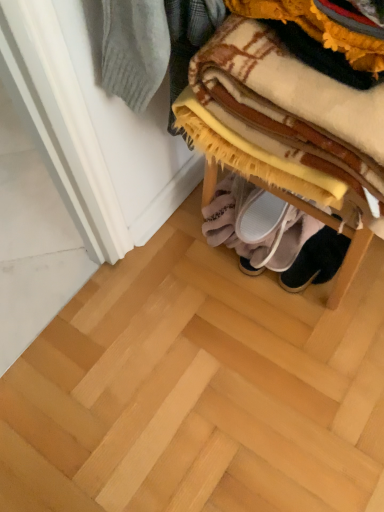
Where is `vacant space positioned to the left of white fabric slipper at lower center, which ranks as the second footwear in right-to-left order`? The height and width of the screenshot is (512, 384). vacant space positioned to the left of white fabric slipper at lower center, which ranks as the second footwear in right-to-left order is located at coordinates (177, 244).